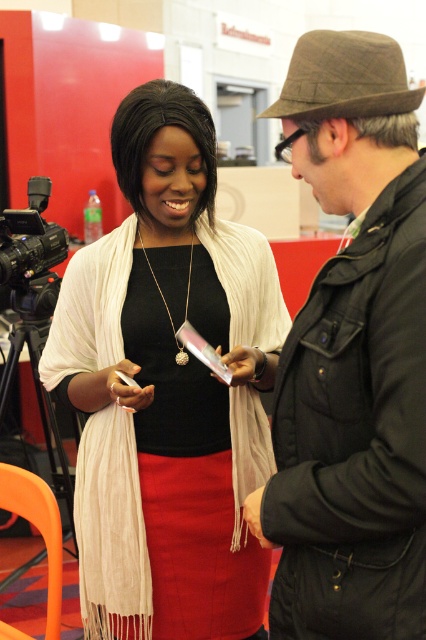
Does matte white scarf at center appear under dark brown woolen hat at upper right?

Yes, matte white scarf at center is below dark brown woolen hat at upper right.

Is matte white scarf at center positioned at the back of dark brown woolen hat at upper right?

That is True.

At what (x,y) coordinates should I click in order to perform the action: click on matte white scarf at center. Please return your answer as a coordinate pair (x, y). The image size is (426, 640). Looking at the image, I should click on (167, 388).